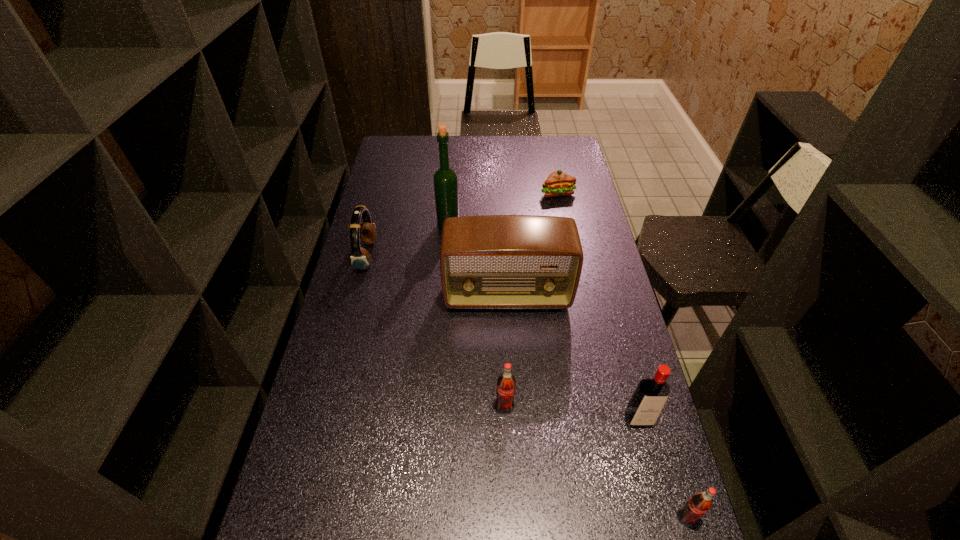
Locate an element on the screen. The image size is (960, 540). free area in between the shortest object and the second shortest object is located at coordinates (622, 355).

Where is `empty space that is in between the fifth nearest object and the taller soda bottle`? empty space that is in between the fifth nearest object and the taller soda bottle is located at coordinates (436, 331).

Where is `empty space that is in between the left soda bottle and the tallest object`? Image resolution: width=960 pixels, height=540 pixels. empty space that is in between the left soda bottle and the tallest object is located at coordinates 476,316.

Image resolution: width=960 pixels, height=540 pixels. I want to click on vacant area that lies between the left soda bottle and the second farthest object, so click(476, 316).

The image size is (960, 540). What are the coordinates of `vacant space that's between the vodka and the shorter soda bottle` in the screenshot? It's located at (662, 468).

Where is `vacant region between the farthest object and the liquor`? The width and height of the screenshot is (960, 540). vacant region between the farthest object and the liquor is located at coordinates (503, 209).

Where is `blank region between the tallest object and the farthest object`? The width and height of the screenshot is (960, 540). blank region between the tallest object and the farthest object is located at coordinates 503,209.

This screenshot has width=960, height=540. What are the coordinates of `object that is the fourth closest to the fourth nearest object` in the screenshot? It's located at (651, 394).

Locate an element on the screen. object that is the second closest to the tallest object is located at coordinates (491, 261).

Where is `free space that satisfies the following two spatial constraints: 1. on the front side of the liquor; 2. on the ear cup of the fifth nearest object`? This screenshot has width=960, height=540. free space that satisfies the following two spatial constraints: 1. on the front side of the liquor; 2. on the ear cup of the fifth nearest object is located at coordinates (446, 255).